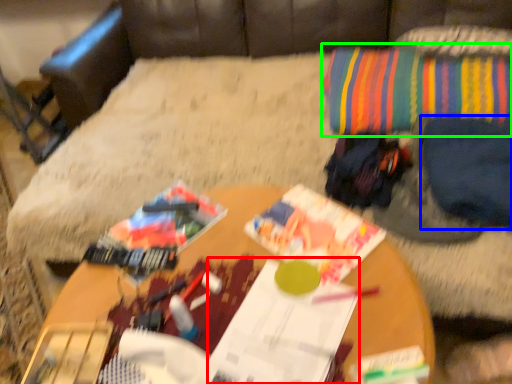
Question: Estimate the real-world distances between objects in this image. Which object is closer to magazine (highlighted by a red box), clothing (highlighted by a blue box) or throw pillow (highlighted by a green box)?

Choices:
 (A) clothing
 (B) throw pillow

Answer: (A)